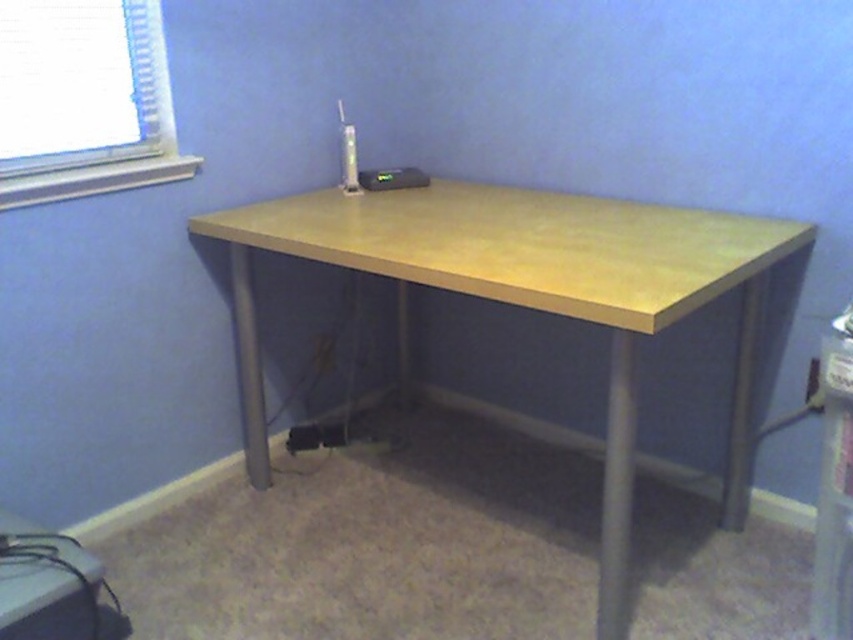
Who is positioned more to the left, light wood/matte finish computer desk at center or black plastic computer at lower left?

black plastic computer at lower left is more to the left.

Is point (457, 252) positioned before point (77, 593)?

No.

Between point (439, 276) and point (39, 577), which one is positioned in front?

Point (39, 577) is more forward.

Image resolution: width=853 pixels, height=640 pixels. In order to click on light wood/matte finish computer desk at center in this screenshot , I will do `click(527, 298)`.